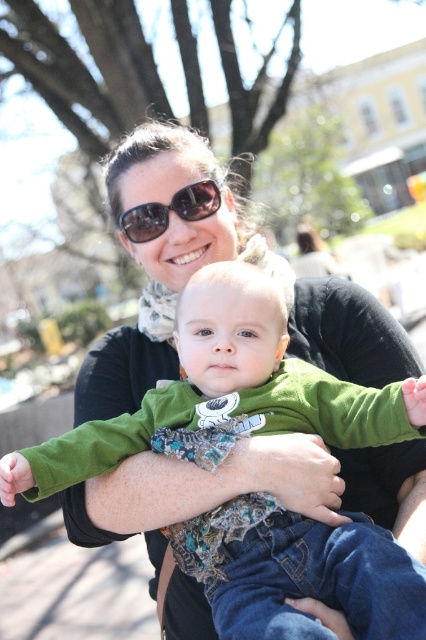
Question: Among these objects, which one is farthest from the camera?

Choices:
 (A) green soft fabric baby at center
 (B) black reflective sunglasses at upper center

Answer: (B)

Question: From the image, what is the correct spatial relationship of green soft fabric baby at center in relation to black reflective sunglasses at upper center?

Choices:
 (A) right
 (B) left

Answer: (A)

Question: Which object is closer to the camera taking this photo?

Choices:
 (A) green soft fabric baby at center
 (B) black reflective sunglasses at upper center

Answer: (A)

Question: Which point is closer to the camera taking this photo?

Choices:
 (A) (138, 212)
 (B) (238, 400)

Answer: (B)

Question: Can you confirm if green soft fabric baby at center is thinner than black reflective sunglasses at upper center?

Choices:
 (A) no
 (B) yes

Answer: (A)

Question: Is green soft fabric baby at center below black reflective sunglasses at upper center?

Choices:
 (A) yes
 (B) no

Answer: (A)